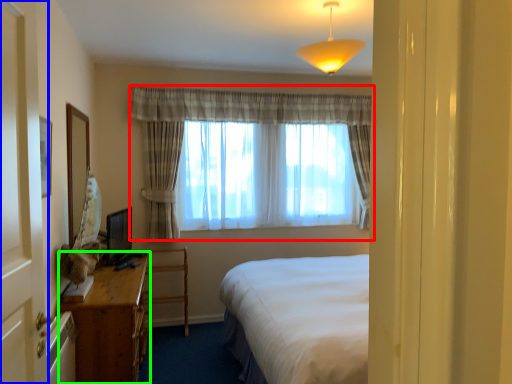
Question: Which object is positioned farthest from curtain (highlighted by a red box)? Select from screen door (highlighted by a blue box) and desk (highlighted by a green box).

Choices:
 (A) screen door
 (B) desk

Answer: (A)